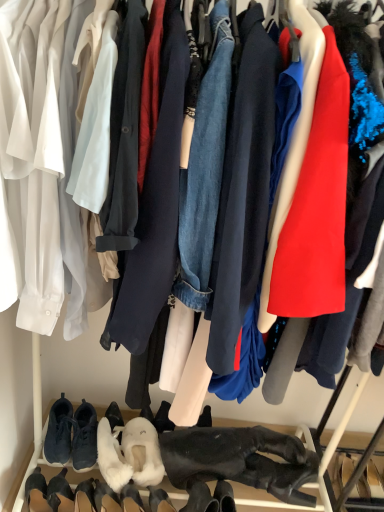
Locate an element on the screen. The width and height of the screenshot is (384, 512). free spot above white fluffy slippers at lower center, the second footwear viewed from the right (from a real-world perspective) is located at coordinates (143, 442).